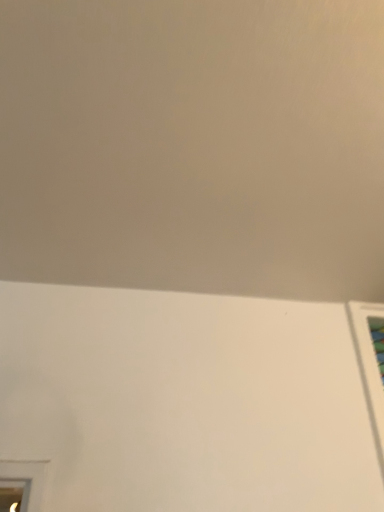
What is the approximate height of transparent glass window at lower left?

5.72 inches.

You are a GUI agent. You are given a task and a screenshot of the screen. Output one action in this format:
    pyautogui.click(x=<x>, y=<y>)
    Task: Click on the transparent glass window at lower left
    
    Given the screenshot: What is the action you would take?
    pyautogui.click(x=14, y=494)

Describe the element at coordinates (14, 494) in the screenshot. I see `transparent glass window at lower left` at that location.

In order to click on transparent glass window at lower left in this screenshot , I will do `click(14, 494)`.